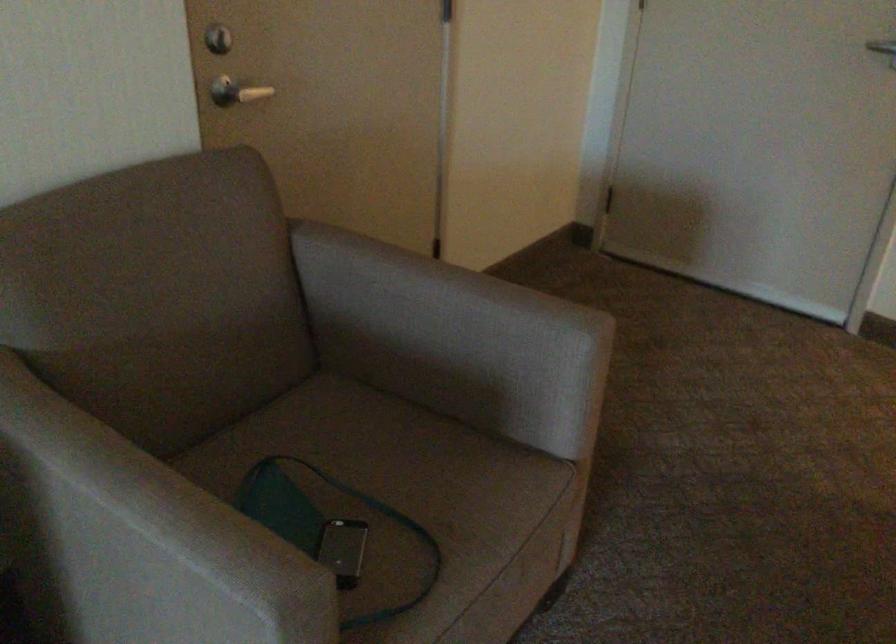
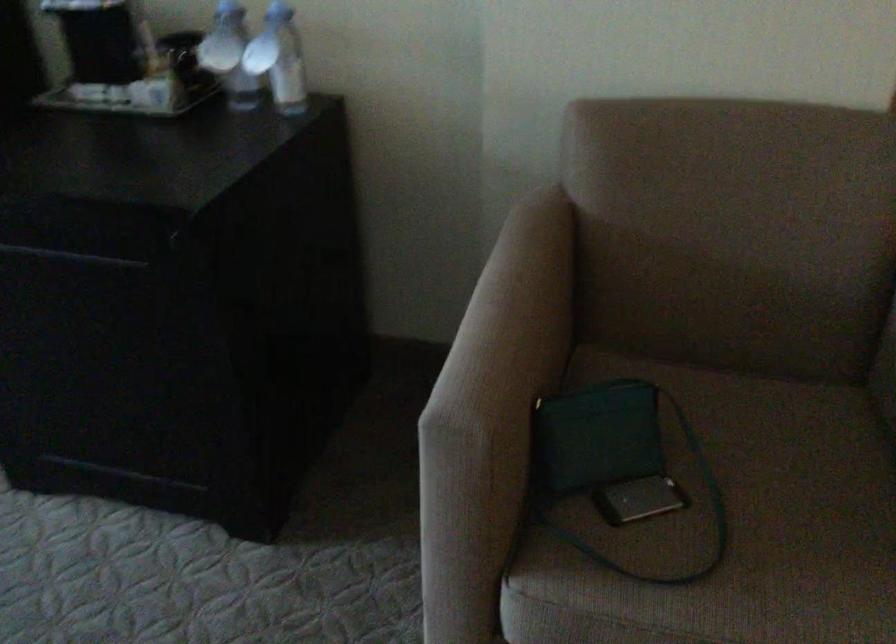
The point at (406, 518) is marked in the first image. Where is the corresponding point in the second image?

(729, 526)